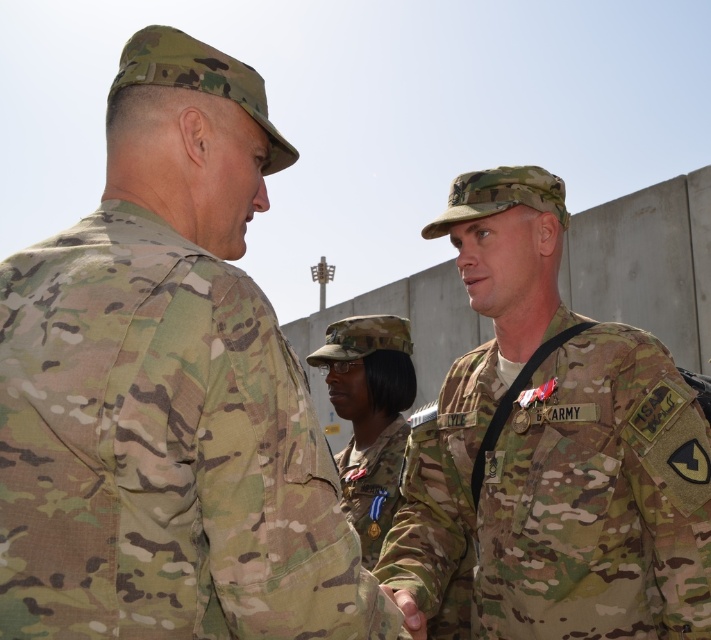
You are a drone operator observing the scene. You need to determine which of the two points, point (429, 612) or point (397, 442), is closer to the camera. Which one is closer?

Point (429, 612) is closer to the camera than point (397, 442).

You are a photographer at a military base. You need to take a photo of two soldiers wearing the multicam uniform at center and the camo uniform at center. According to the scene description, which soldier should stand to the left in the photo to match their current positions?

The multicam uniform at center should stand to the left in the photo because it is already positioned on the left side of the camo uniform at center in the scene.